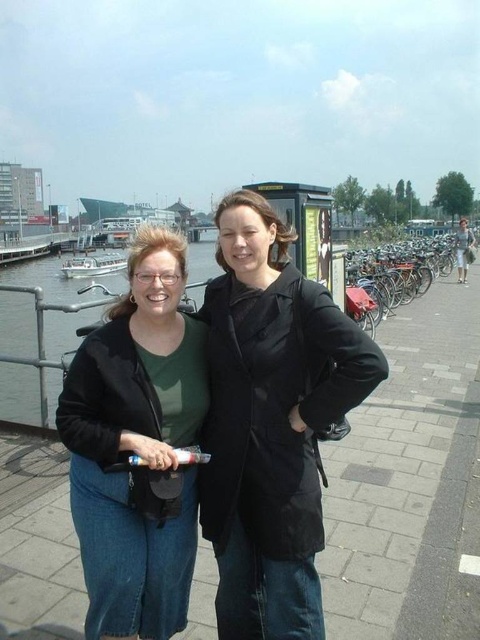
At what (x,y) coordinates should I click in order to perform the action: click on paved stone sidewalk at center. Please return your answer as a coordinate pair (x, y). Looking at the image, I should click on (409, 481).

Can you confirm if paved stone sidewalk at center is bigger than green matte shirt at center?

Yes.

Which is behind, point (416, 550) or point (82, 499)?

Point (416, 550)

Where is `paved stone sidewalk at center`? Image resolution: width=480 pixels, height=640 pixels. paved stone sidewalk at center is located at coordinates (409, 481).

Is paved stone sidewalk at center below black matte coat at center?

No, paved stone sidewalk at center is not below black matte coat at center.

Is point (444, 280) positioned behind point (244, 628)?

Yes, it is behind point (244, 628).

Image resolution: width=480 pixels, height=640 pixels. Identify the location of paved stone sidewalk at center. (409, 481).

Is black matte coat at center taller than green matte shirt at center?

Incorrect, black matte coat at center's height is not larger of green matte shirt at center's.

The height and width of the screenshot is (640, 480). I want to click on black matte coat at center, so click(271, 422).

Describe the element at coordinates (271, 422) in the screenshot. Image resolution: width=480 pixels, height=640 pixels. I see `black matte coat at center` at that location.

Image resolution: width=480 pixels, height=640 pixels. I want to click on black matte coat at center, so click(271, 422).